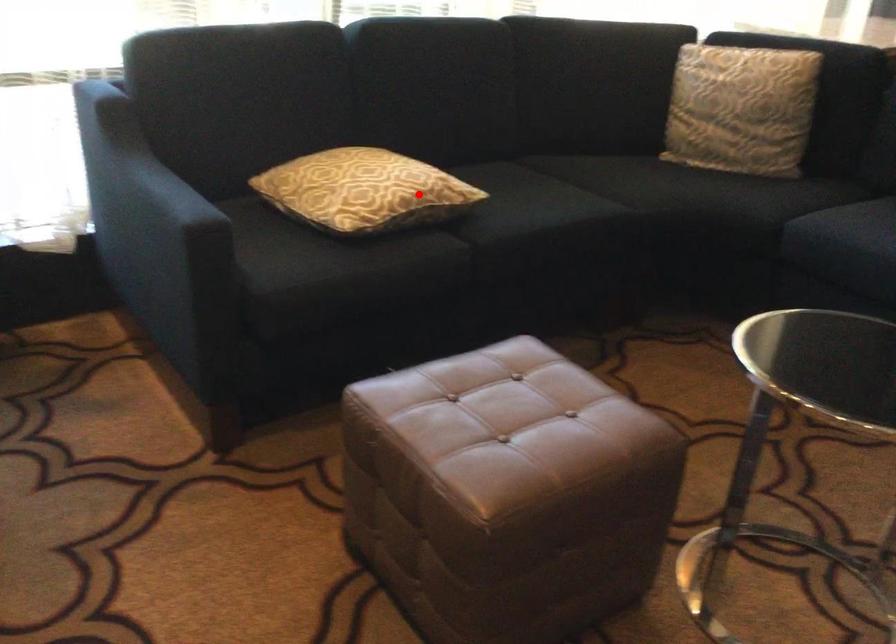
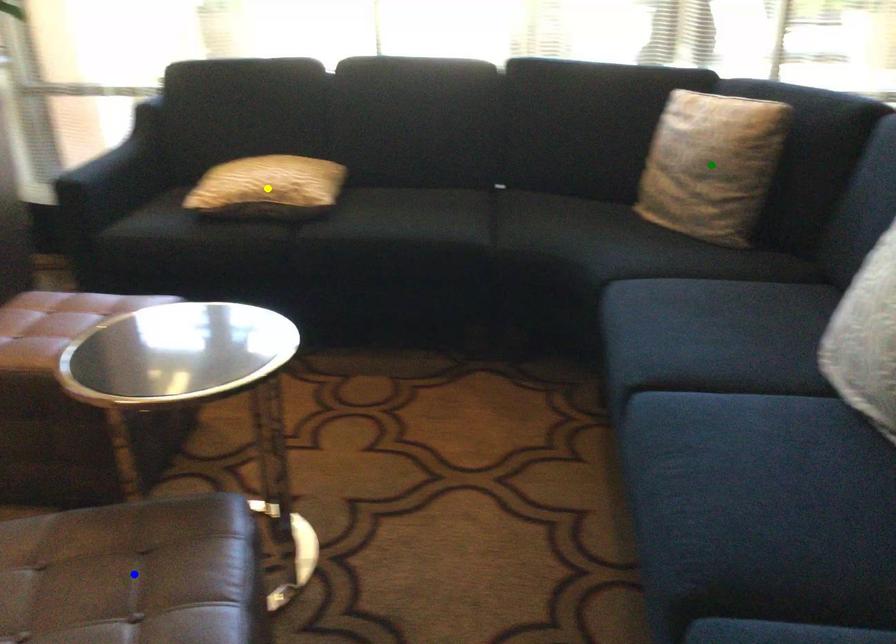
Question: I am providing you with two images of the same scene from different viewpoints. A red point is marked on the first image. You are given multiple points on the second image. Which point in image 2 is actually the same real-world point as the red point in image 1?

Choices:
 (A) green point
 (B) yellow point
 (C) blue point

Answer: (B)